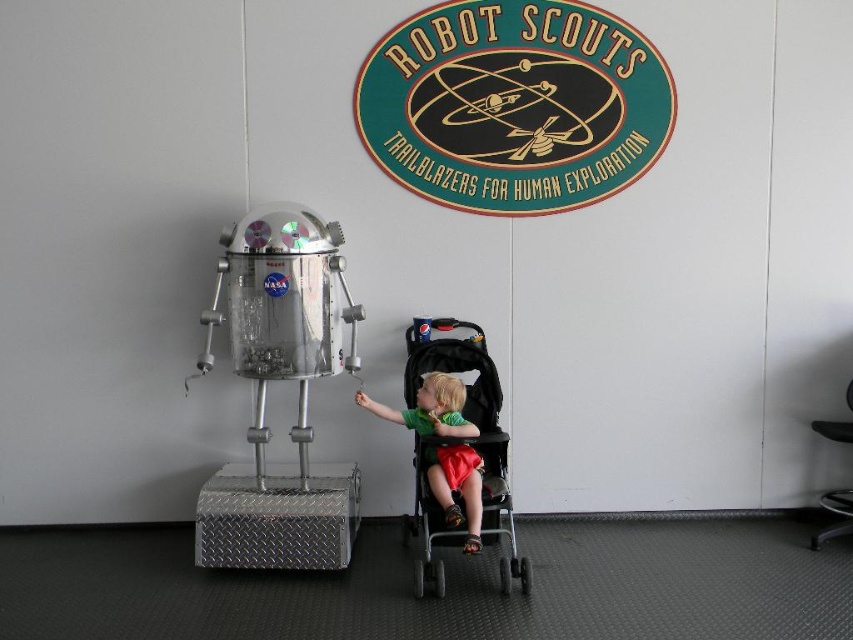
Question: Observing the image, what is the correct spatial positioning of black fabric stroller at lower center in reference to green fabric shirt at lower center?

Choices:
 (A) right
 (B) left

Answer: (A)

Question: Is black fabric stroller at lower center to the right of green fabric shirt at lower center from the viewer's perspective?

Choices:
 (A) yes
 (B) no

Answer: (A)

Question: Where is black fabric stroller at lower center located in relation to green fabric shirt at lower center in the image?

Choices:
 (A) above
 (B) below

Answer: (B)

Question: Which of the following is the farthest from the observer?

Choices:
 (A) black fabric stroller at lower center
 (B) green fabric shirt at lower center

Answer: (A)

Question: Which point is closer to the camera taking this photo?

Choices:
 (A) (437, 396)
 (B) (482, 360)

Answer: (A)